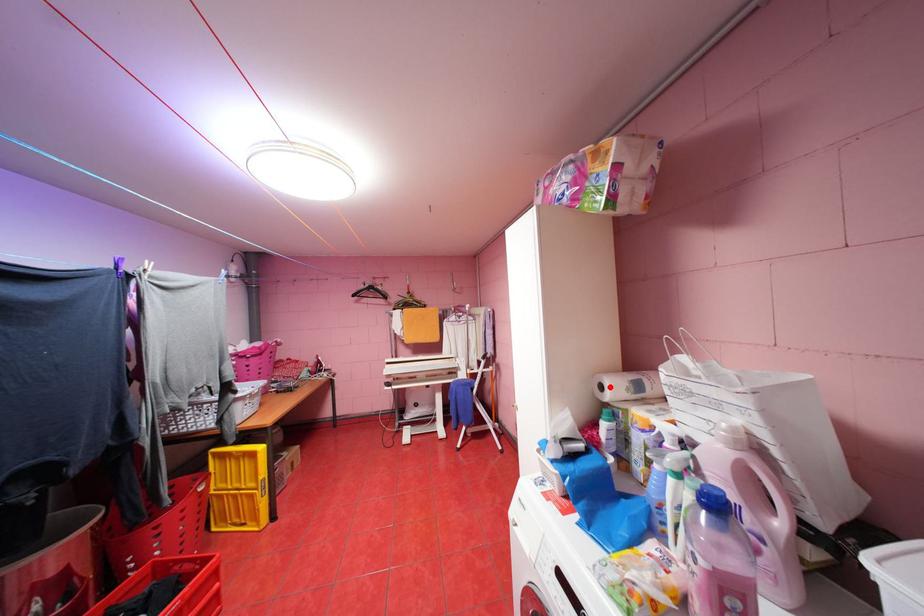
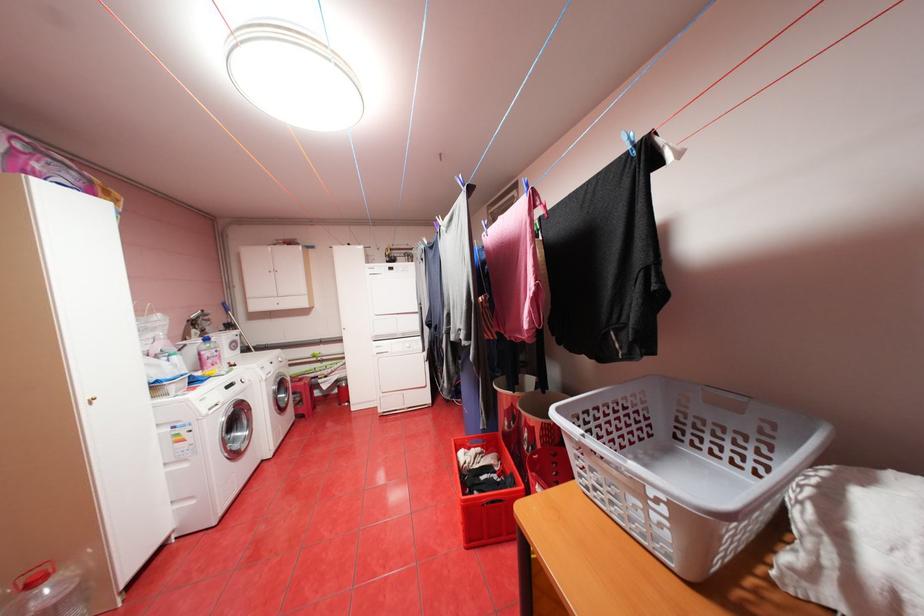
Question: I am providing you with two images of the same scene from different viewpoints. A red point is marked on the first image. At the location where the point appears in image 1, is it still visible in image 2?

Choices:
 (A) Yes
 (B) No

Answer: (B)